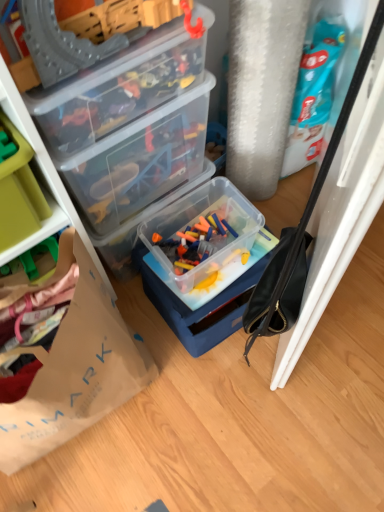
At what (x,y) coordinates should I click in order to perform the action: click on space that is in front of translucent plastic container at center, the 3th box in the top-to-bottom sequence. Please return your answer as a coordinate pair (x, y). The height and width of the screenshot is (512, 384). Looking at the image, I should click on (238, 407).